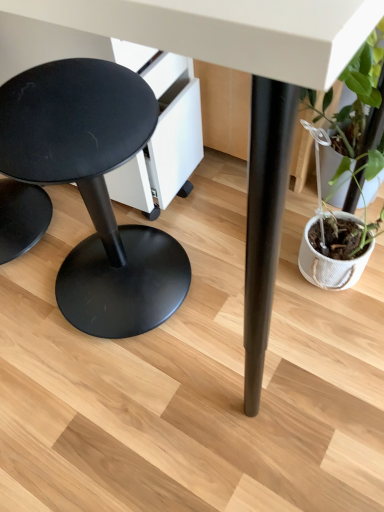
Question: Considering the positions of point (355, 83) and point (115, 272), is point (355, 83) closer or farther from the camera than point (115, 272)?

Choices:
 (A) closer
 (B) farther

Answer: (A)

Question: From the image's perspective, is green leafy plant in woven pot at right above or below matte black stool at left?

Choices:
 (A) above
 (B) below

Answer: (A)

Question: Is green leafy plant in woven pot at right inside or outside of matte black stool at left?

Choices:
 (A) inside
 (B) outside

Answer: (B)

Question: From the image's perspective, is matte black stool at left positioned above or below green leafy plant in woven pot at right?

Choices:
 (A) above
 (B) below

Answer: (B)

Question: Looking at their shapes, would you say matte black stool at left is wider or thinner than green leafy plant in woven pot at right?

Choices:
 (A) wide
 (B) thin

Answer: (A)

Question: Is point (64, 66) closer or farther from the camera than point (349, 167)?

Choices:
 (A) closer
 (B) farther

Answer: (A)

Question: Is matte black stool at left to the left or to the right of green leafy plant in woven pot at right in the image?

Choices:
 (A) right
 (B) left

Answer: (B)